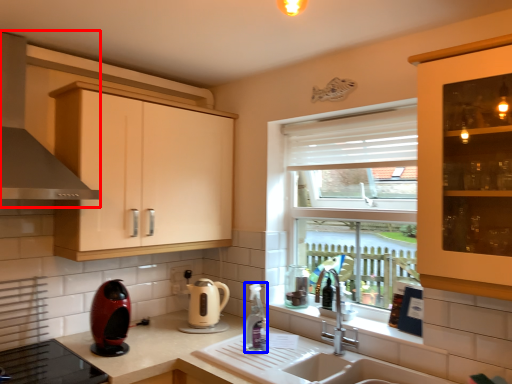
Question: Which object is further to the camera taking this photo, exhaust hood (highlighted by a red box) or bottle (highlighted by a blue box)?

Choices:
 (A) exhaust hood
 (B) bottle

Answer: (B)